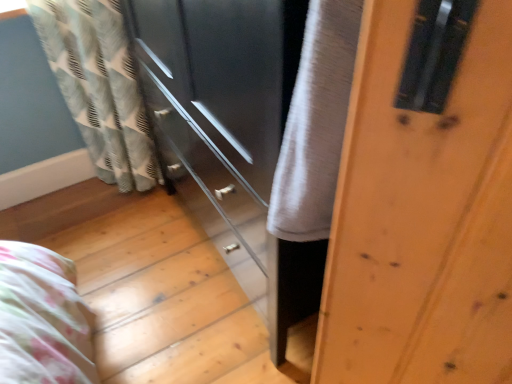
Locate an element on the screen. The width and height of the screenshot is (512, 384). free space in front of patterned fabric curtain at left is located at coordinates pos(119,241).